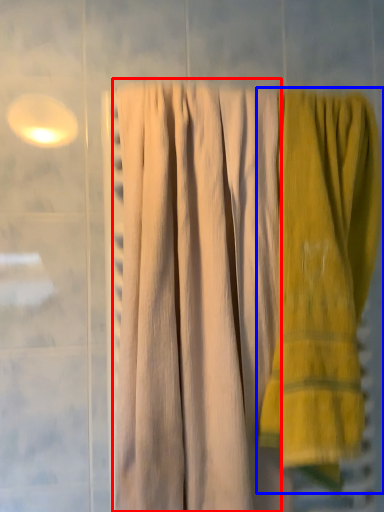
Question: Which of the following is the farthest to the observer, curtain (highlighted by a red box) or towel (highlighted by a blue box)?

Choices:
 (A) curtain
 (B) towel

Answer: (B)